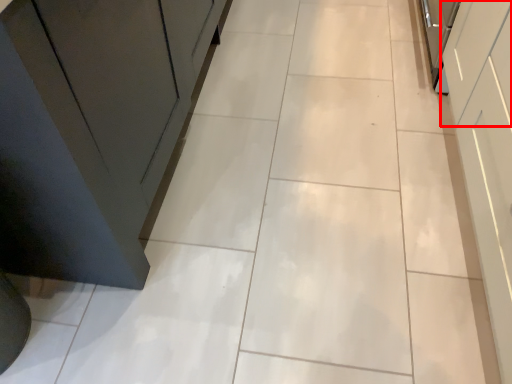
Question: Considering the relative positions of drawer (annotated by the red box) and cabinetry in the image provided, where is drawer (annotated by the red box) located with respect to the staircase?

Choices:
 (A) right
 (B) left

Answer: (A)